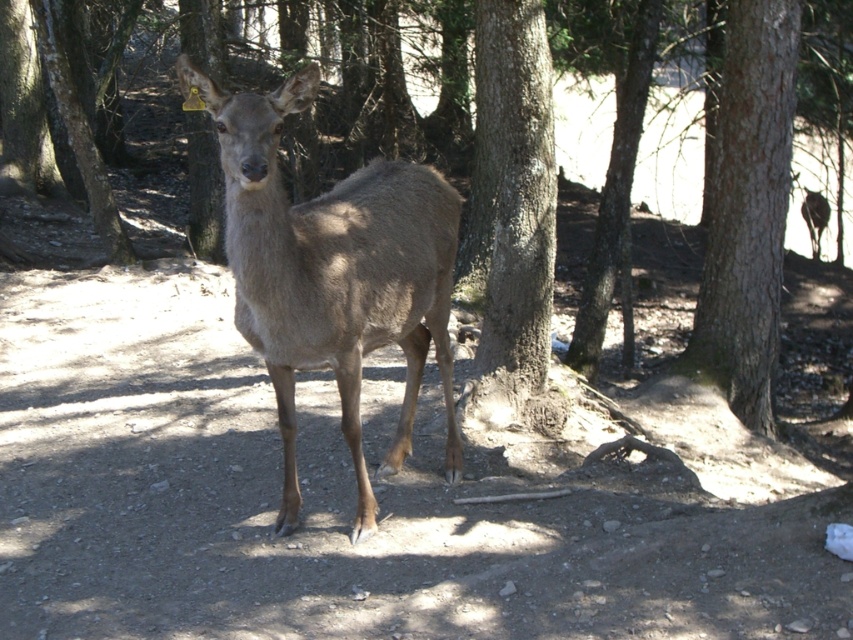
Question: Estimate the real-world distances between objects in this image. Which object is closer to the brown rough tree at center?

Choices:
 (A) smooth bark tree at center
 (B) brown fur deer at center

Answer: (A)

Question: Does brown fur deer at center appear on the right side of brown rough tree at center?

Choices:
 (A) yes
 (B) no

Answer: (B)

Question: Does brown fur deer at center appear on the left side of smooth bark tree at center?

Choices:
 (A) no
 (B) yes

Answer: (B)

Question: Which of the following is the closest to the observer?

Choices:
 (A) brown rough tree at center
 (B) smooth bark tree at center

Answer: (B)

Question: Does brown fur deer at center have a greater width compared to brown rough tree at center?

Choices:
 (A) yes
 (B) no

Answer: (A)

Question: Which point is farther from the camera taking this photo?

Choices:
 (A) (751, 316)
 (B) (500, 362)
 (C) (363, 250)

Answer: (A)